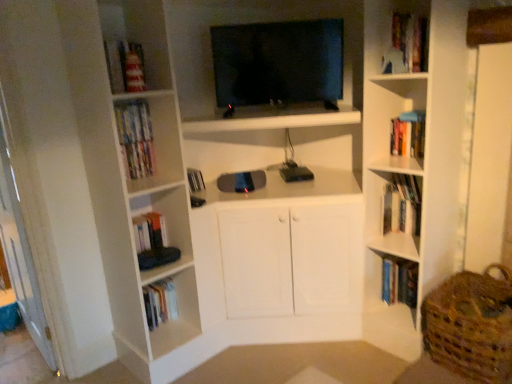
Question: Are hardcover books at upper right, which is counted as the 5th book, starting from the left, and white matte book at upper right, arranged as the fourth book when viewed from the right, beside each other?

Choices:
 (A) yes
 (B) no

Answer: (B)

Question: From a real-world perspective, is hardcover books at upper right, placed as the 4th book when sorted from bottom to top, physically above white matte book at upper right, the fourth book viewed from the top?

Choices:
 (A) no
 (B) yes

Answer: (B)

Question: Considering the relative sizes of hardcover books at upper right, which is counted as the 5th book, starting from the left, and white matte book at upper right, which is the 2th book in bottom-to-top order, in the image provided, is hardcover books at upper right, which is counted as the 5th book, starting from the left, smaller than white matte book at upper right, which is the 2th book in bottom-to-top order,?

Choices:
 (A) no
 (B) yes

Answer: (A)

Question: Considering the relative sizes of hardcover books at upper right, the 2th book when ordered from top to bottom, and white matte book at upper right, arranged as the fourth book when viewed from the right, in the image provided, is hardcover books at upper right, the 2th book when ordered from top to bottom, shorter than white matte book at upper right, arranged as the fourth book when viewed from the right,?

Choices:
 (A) no
 (B) yes

Answer: (B)

Question: From the image's perspective, is hardcover books at upper right, acting as the 1th book starting from the right, above white matte book at upper right, which is the second book from left to right?

Choices:
 (A) yes
 (B) no

Answer: (A)

Question: Is hardcover books at upper right, the 2th book when ordered from top to bottom, positioned in front of white matte book at upper right, which is the second book from left to right?

Choices:
 (A) no
 (B) yes

Answer: (B)

Question: Considering the relative positions of wooden bookshelf at upper right and matte plastic bookshelf at upper left, which appears as the 5th book when viewed from the right, in the image provided, is wooden bookshelf at upper right to the left of matte plastic bookshelf at upper left, which appears as the 5th book when viewed from the right, from the viewer's perspective?

Choices:
 (A) yes
 (B) no

Answer: (B)

Question: Is wooden bookshelf at upper right looking in the opposite direction of matte plastic bookshelf at upper left, which appears as the fifth book when ordered from the bottom?

Choices:
 (A) yes
 (B) no

Answer: (B)

Question: From a real-world perspective, is wooden bookshelf at upper right over matte plastic bookshelf at upper left, the first book in the left-to-right sequence?

Choices:
 (A) yes
 (B) no

Answer: (A)

Question: From a real-world perspective, is wooden bookshelf at upper right under matte plastic bookshelf at upper left, which appears as the fifth book when ordered from the bottom?

Choices:
 (A) yes
 (B) no

Answer: (B)

Question: Is wooden bookshelf at upper right shorter than matte plastic bookshelf at upper left, the first book in the left-to-right sequence?

Choices:
 (A) no
 (B) yes

Answer: (A)

Question: Could matte plastic bookshelf at upper left, positioned as the first book in top-to-bottom order, be considered to be inside wooden bookshelf at upper right?

Choices:
 (A) no
 (B) yes

Answer: (A)

Question: Is hardcover books at upper right, acting as the 1th book starting from the right, oriented away from woven brown basket at lower right?

Choices:
 (A) no
 (B) yes

Answer: (A)